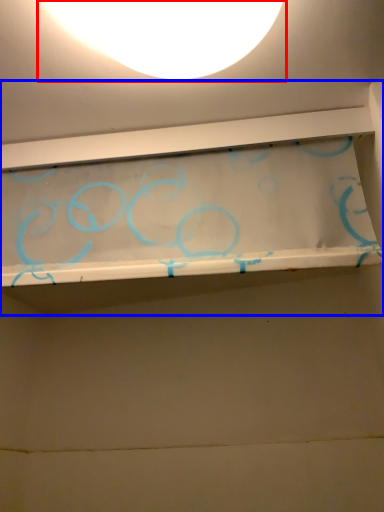
Question: Which object appears farthest to the camera in this image, lamp (highlighted by a red box) or shelf (highlighted by a blue box)?

Choices:
 (A) lamp
 (B) shelf

Answer: (B)